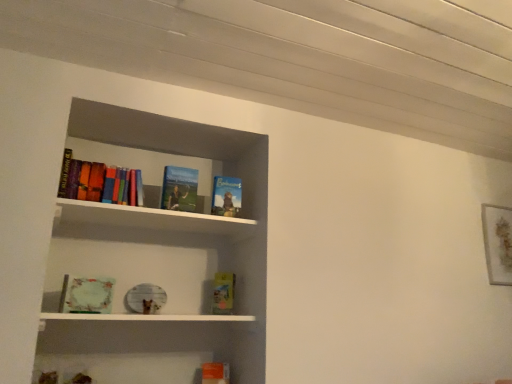
Question: Would you say matte green book at lower left, acting as the 4th book starting from the top, contains hardcover book at upper center, which appears as the fifth book when ordered from the bottom?

Choices:
 (A) no
 (B) yes

Answer: (A)

Question: Is matte green book at lower left, acting as the 4th book starting from the top, positioned in front of hardcover book at upper center, which appears as the fifth book when ordered from the bottom?

Choices:
 (A) yes
 (B) no

Answer: (A)

Question: Would you consider matte green book at lower left, which ranks as the 3th book in bottom-to-top order, to be distant from hardcover book at upper center, which appears as the fifth book when ordered from the bottom?

Choices:
 (A) yes
 (B) no

Answer: (B)

Question: From the image's perspective, is matte green book at lower left, which ranks as the 3th book in bottom-to-top order, beneath hardcover book at upper center, which appears as the fifth book when ordered from the bottom?

Choices:
 (A) yes
 (B) no

Answer: (A)

Question: Can you confirm if matte green book at lower left, which ranks as the 3th book in bottom-to-top order, is thinner than hardcover book at upper center, which appears as the fifth book when ordered from the bottom?

Choices:
 (A) yes
 (B) no

Answer: (A)

Question: Could you tell me if matte green book at lower left, which ranks as the 3th book in bottom-to-top order, is facing hardcover book at upper center, which appears as the fifth book when ordered from the bottom?

Choices:
 (A) no
 (B) yes

Answer: (A)

Question: From the image's perspective, is multicolored hardcover books at upper left, the sixth book ordered from the bottom, below matte green book at lower left, which ranks as the 3th book in bottom-to-top order?

Choices:
 (A) yes
 (B) no

Answer: (B)

Question: From a real-world perspective, is multicolored hardcover books at upper left, the sixth book ordered from the bottom, located higher than matte green book at lower left, acting as the 4th book starting from the top?

Choices:
 (A) no
 (B) yes

Answer: (B)

Question: Can you confirm if multicolored hardcover books at upper left, the sixth book ordered from the bottom, is wider than matte green book at lower left, which ranks as the 3th book in bottom-to-top order?

Choices:
 (A) no
 (B) yes

Answer: (B)

Question: Is matte green book at lower left, acting as the 4th book starting from the top, at the back of multicolored hardcover books at upper left, the first book when ordered from top to bottom?

Choices:
 (A) yes
 (B) no

Answer: (B)

Question: Can we say multicolored hardcover books at upper left, the sixth book ordered from the bottom, lies outside matte green book at lower left, acting as the 4th book starting from the top?

Choices:
 (A) no
 (B) yes

Answer: (B)

Question: From the image's perspective, is multicolored hardcover books at upper left, the sixth book ordered from the bottom, on top of matte green book at lower left, acting as the 4th book starting from the top?

Choices:
 (A) no
 (B) yes

Answer: (B)

Question: Considering the relative positions of multicolored hardcover books at upper left, the first book when ordered from top to bottom, and hardcover book at center, marked as the 2th book in a bottom-to-top arrangement, in the image provided, is multicolored hardcover books at upper left, the first book when ordered from top to bottom, in front of hardcover book at center, marked as the 2th book in a bottom-to-top arrangement,?

Choices:
 (A) yes
 (B) no

Answer: (A)